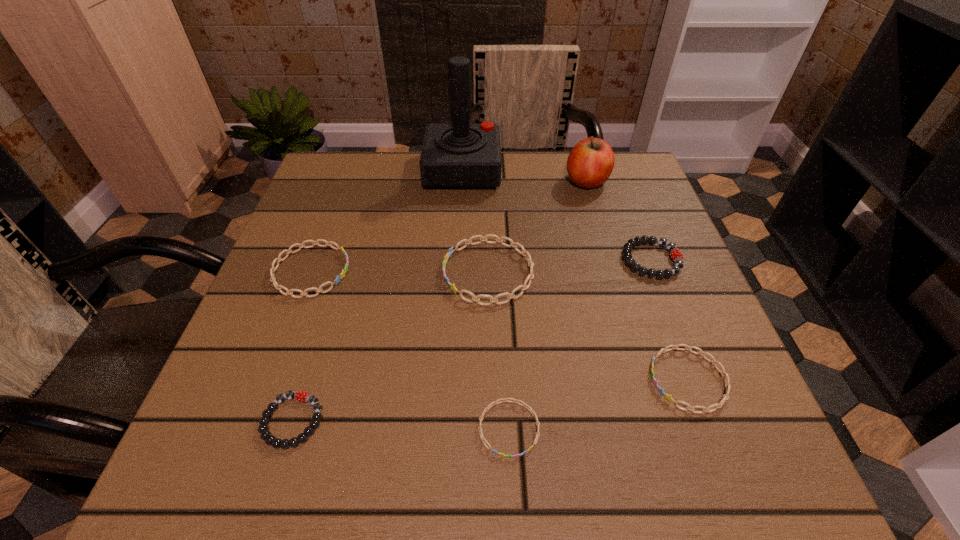
Image resolution: width=960 pixels, height=540 pixels. Find the location of `the smaller black bracelet`. the smaller black bracelet is located at coordinates (265, 435).

Locate an element on the screen. The width and height of the screenshot is (960, 540). the smallest blue bracelet is located at coordinates (492, 404).

Identify the location of the shortest object. This screenshot has height=540, width=960. (492, 404).

The width and height of the screenshot is (960, 540). I want to click on blank space located on the base of the red joystick, so click(531, 171).

You are a GUI agent. You are given a task and a screenshot of the screen. Output one action in this format:
    pyautogui.click(x=<x>, y=<y>)
    Task: Click on the free location located 0.340m on the front of the seventh shortest object
    The width and height of the screenshot is (960, 540).
    Given the screenshot: What is the action you would take?
    pyautogui.click(x=623, y=304)

This screenshot has height=540, width=960. Find the location of `vacant space situated on the surface of the tallest bracelet showing star-shaped elements`. vacant space situated on the surface of the tallest bracelet showing star-shaped elements is located at coordinates (296, 272).

I want to click on vacant space located on the surface of the tallest bracelet showing star-shaped elements, so click(342, 272).

Find the location of a particular element. This screenshot has height=540, width=960. vacant region located 0.210m on the surface of the tallest bracelet showing star-shaped elements is located at coordinates (336, 272).

Locate an element on the screen. This screenshot has height=540, width=960. free region located 0.140m on the surface of the third smallest blue bracelet showing star-shaped elements is located at coordinates (420, 271).

Find the location of a particular element. This screenshot has height=540, width=960. vacant space located 0.280m on the front of the farther black bracelet is located at coordinates (713, 418).